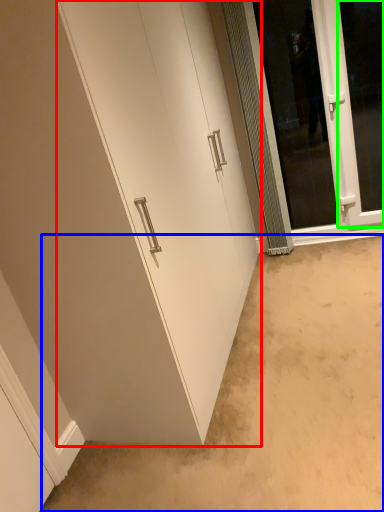
Question: Which object is the closest to the door (highlighted by a red box)? Choose among these: plain (highlighted by a blue box) or window (highlighted by a green box).

Choices:
 (A) plain
 (B) window

Answer: (A)